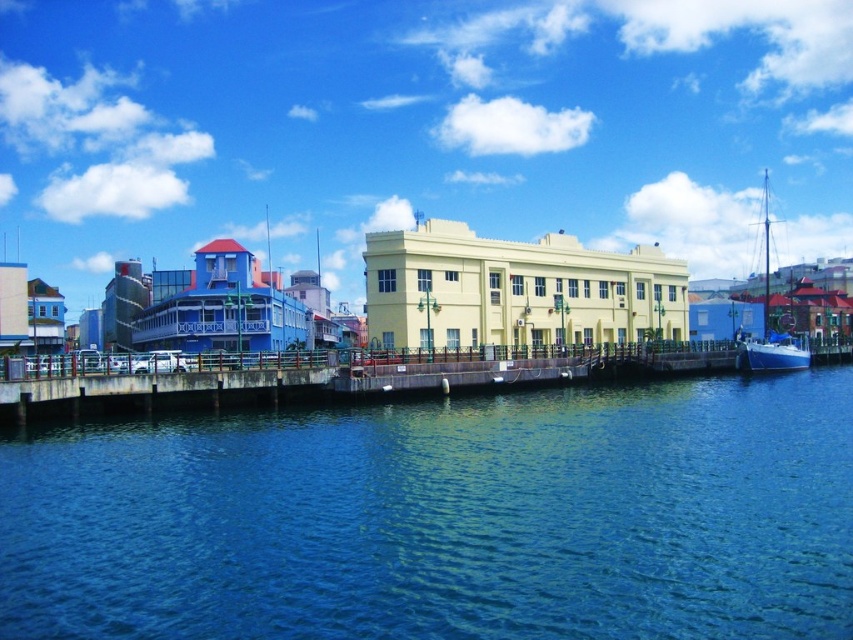
Does blue water at lower center have a lesser width compared to blue matte sailboat at right?

Yes.

Can you confirm if blue water at lower center is positioned to the right of blue matte sailboat at right?

Incorrect, blue water at lower center is not on the right side of blue matte sailboat at right.

This screenshot has height=640, width=853. What do you see at coordinates (445, 518) in the screenshot?
I see `blue water at lower center` at bounding box center [445, 518].

This screenshot has height=640, width=853. Identify the location of blue water at lower center. (445, 518).